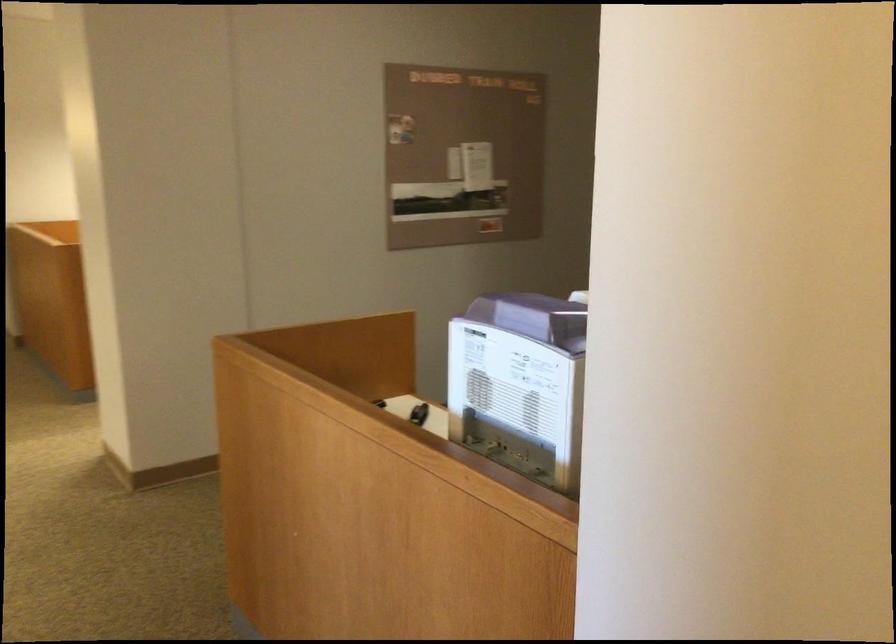
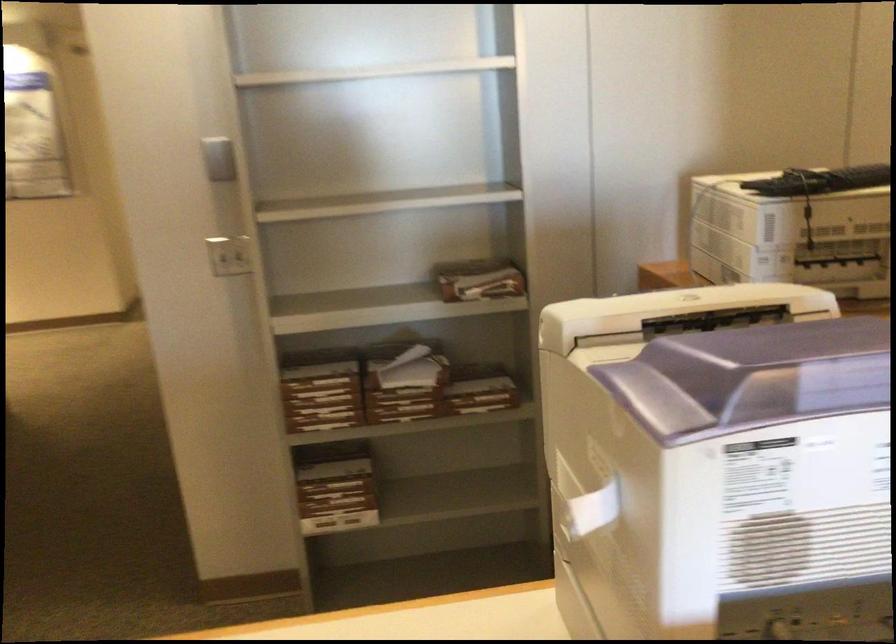
Locate, in the second image, the point that corresponds to pixel 476 352 in the first image.

(592, 507)